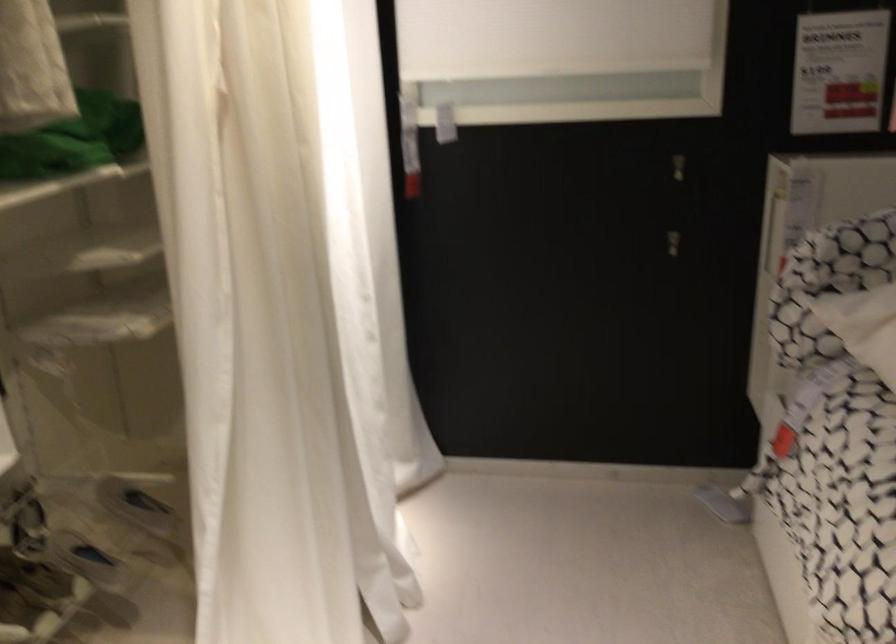
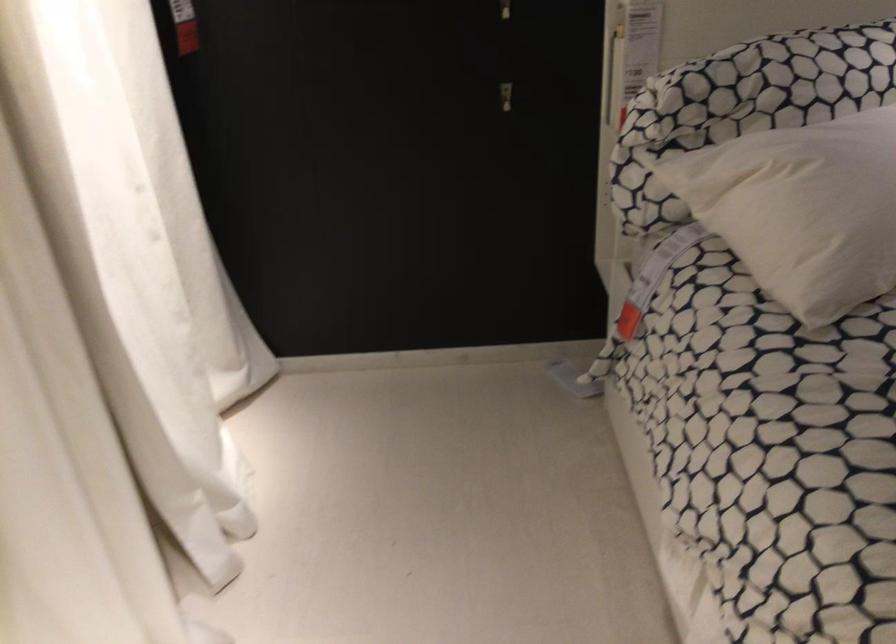
Locate, in the second image, the point that corresponds to point 681,163 in the first image.

(512, 14)